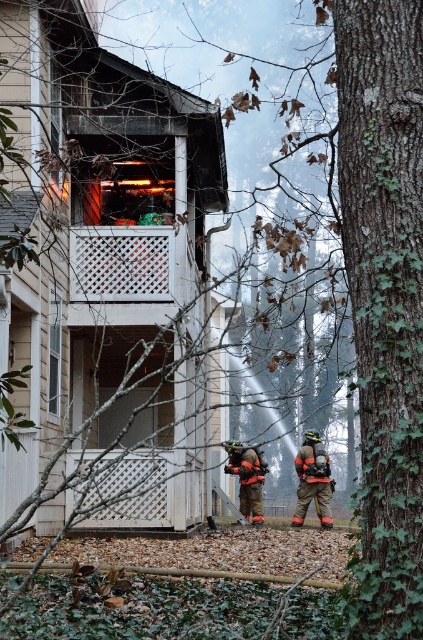
You are a firefighter supervisor observing the scene. You notice two firefighters in orange gear. Which firefighter is closer to the ground? The one in the orange reflective suit at lower right or the orange reflective gear at lower center?

The orange reflective suit at lower right is located below orange reflective gear at lower center, so the firefighter in the orange reflective suit at lower right is closer to the ground.

You are a drone operator trying to capture the scene of the fire. The drone has a camera with a zoom lens that can focus on a specific point. If you want to capture the firefighter in the orange reflective suit at lower right, what coordinates should you aim the camera at?

The orange reflective suit at lower right is located at coordinates point (313, 481), so you should aim the camera at point (313, 481) to capture the firefighter in the orange reflective suit at lower right.

You are a firefighter trying to reach the fire source on the upper floor balcony. There is a point marked at coordinates (313, 481) which corresponds to an orange reflective suit at lower right. How does the orange reflective suit at lower right affect your path to the upper floor balcony?

The orange reflective suit at lower right is located at point (313, 481), which is in the lower right area of the scene. Since the fire source is on the upper floor balcony, the orange reflective suit at lower right does not directly block your path but may indicate a firefighter positioned there, so you should navigate around that area to reach the upper floor balcony safely.